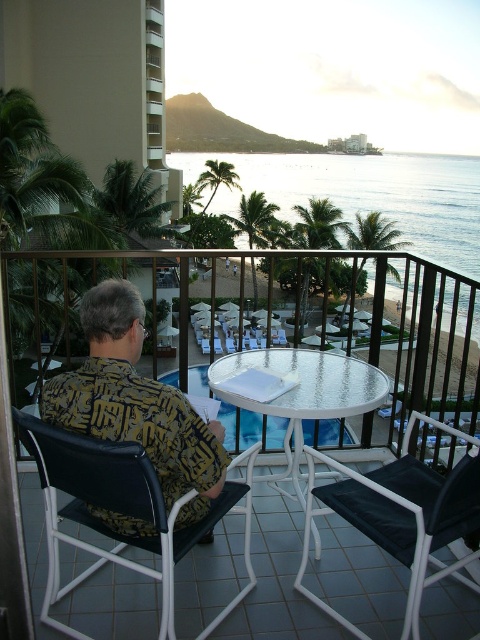
You are a delivery drone with a wingspan of 2 meters. You need to fly through the space between the beige concrete balcony at left and the black fabric chair at lower left to deliver a package. Can you fit through the space?

The distance between the beige concrete balcony at left and the black fabric chair at lower left is 32.07 meters. Since your wingspan is only 2 meters, you can easily fit through the space between the beige concrete balcony at left and the black fabric chair at lower left.